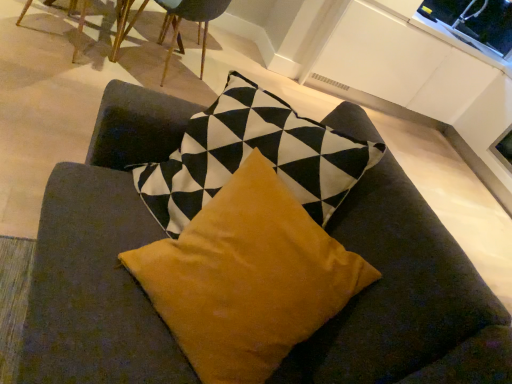
Question: From the image's perspective, relative to wooden chair at upper left, positioned as the 1th chair in left-to-right order, is transparent glass window screen at upper right above or below?

Choices:
 (A) below
 (B) above

Answer: (A)

Question: From a real-world perspective, relative to wooden chair at upper left, positioned as the 1th chair in left-to-right order, is transparent glass window screen at upper right vertically above or below?

Choices:
 (A) below
 (B) above

Answer: (B)

Question: Which is farther from the transparent glass window screen at upper right?

Choices:
 (A) wooden chair at upper left, the second chair positioned from the right
 (B) mustard velvet pillow at center
 (C) wooden chair at upper center, marked as the 2th chair in a left-to-right arrangement

Answer: (B)

Question: Estimate the real-world distances between objects in this image. Which object is closer to the transparent glass window screen at upper right?

Choices:
 (A) wooden chair at upper left, the second chair positioned from the right
 (B) mustard velvet pillow at center
 (C) wooden chair at upper center, marked as the 2th chair in a left-to-right arrangement

Answer: (C)